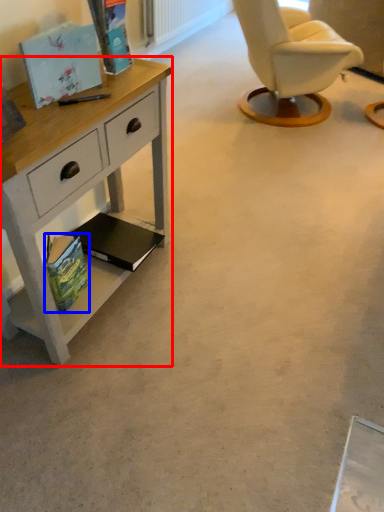
Question: Which object appears closest to the camera in this image, desk (highlighted by a red box) or magazine (highlighted by a blue box)?

Choices:
 (A) desk
 (B) magazine

Answer: (A)